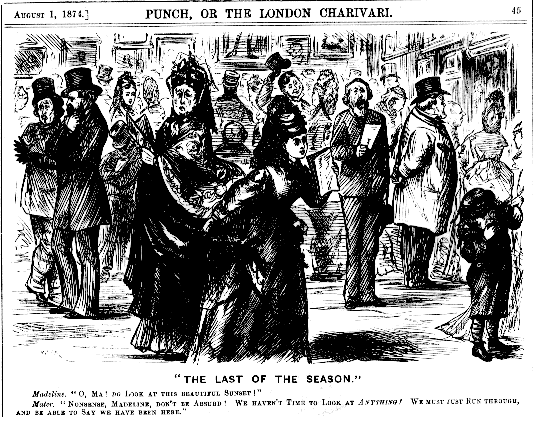
Identify the location of framed picture on wall. tap(454, 53), tap(419, 65), tap(341, 45), tap(296, 43), tap(27, 61), tap(82, 51), tap(133, 58), tap(233, 49).